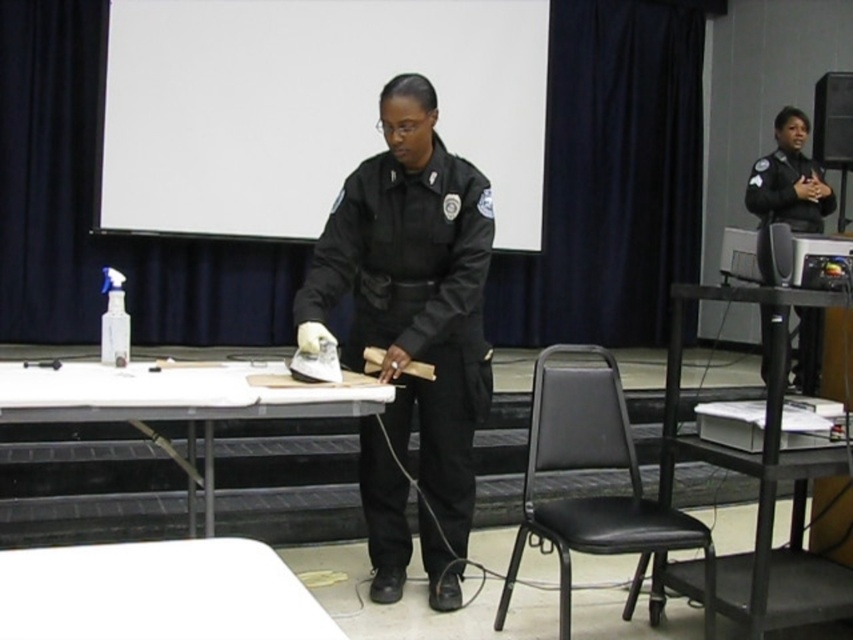
Is black matte uniform at center below white plastic table at lower left?

No.

What do you see at coordinates (416, 305) in the screenshot? I see `black matte uniform at center` at bounding box center [416, 305].

Locate an element on the screen. The image size is (853, 640). black matte uniform at center is located at coordinates coord(416,305).

Can you confirm if white matte projection screen at upper center is thinner than black matte uniform at upper right?

In fact, white matte projection screen at upper center might be wider than black matte uniform at upper right.

Which is below, white matte projection screen at upper center or black matte uniform at upper right?

black matte uniform at upper right is below.

Locate an element on the screen. The height and width of the screenshot is (640, 853). white matte projection screen at upper center is located at coordinates (309, 108).

Does black matte uniform at center appear on the left side of white plastic table at center?

No, black matte uniform at center is not to the left of white plastic table at center.

Between point (421, 384) and point (332, 403), which one is positioned behind?

The point (421, 384) is behind.

Does point (469, 396) come farther from viewer compared to point (141, 416)?

That is True.

Find the location of a particular element. The height and width of the screenshot is (640, 853). black matte uniform at center is located at coordinates (416, 305).